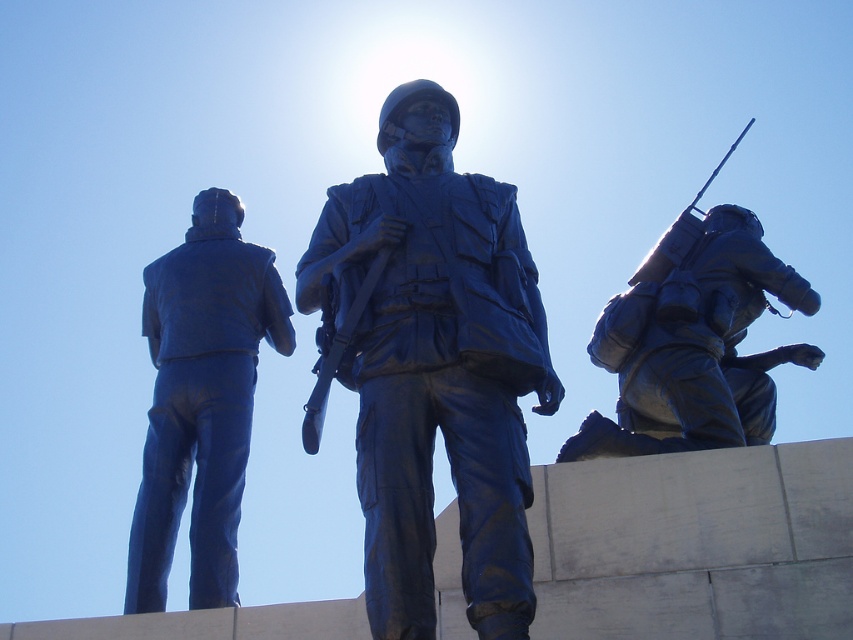
Question: Does blue polished metal soldier at center appear on the left side of matte blue soldier at right?

Choices:
 (A) yes
 (B) no

Answer: (A)

Question: Is the position of blue polished statue at left less distant than that of matte blue soldier at right?

Choices:
 (A) no
 (B) yes

Answer: (B)

Question: Among these objects, which one is farthest from the camera?

Choices:
 (A) shiny metallic rifle at center
 (B) blue polished metal soldier at center
 (C) blue polished statue at left
 (D) matte blue soldier at right

Answer: (D)

Question: Is blue polished metal soldier at center bigger than shiny metallic rifle at center?

Choices:
 (A) no
 (B) yes

Answer: (B)

Question: Estimate the real-world distances between objects in this image. Which object is closer to the matte blue soldier at right?

Choices:
 (A) blue polished statue at left
 (B) shiny metallic rifle at center

Answer: (A)

Question: Which of the following is the closest to the observer?

Choices:
 (A) (738, 436)
 (B) (312, 429)
 (C) (184, 492)
 (D) (355, 248)

Answer: (B)